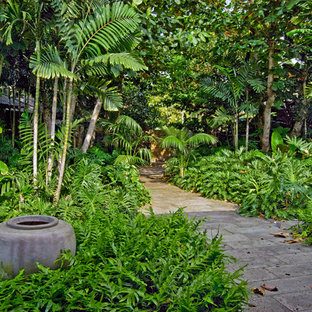
Where is `small round gray pot`? This screenshot has width=312, height=312. small round gray pot is located at coordinates (38, 237).